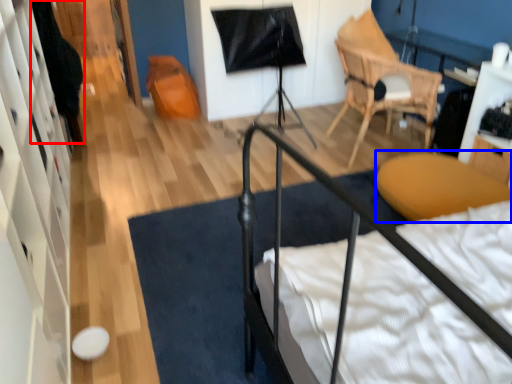
Question: Among these objects, which one is nearest to the camera, dark (highlighted by a red box) or furniture (highlighted by a blue box)?

Choices:
 (A) dark
 (B) furniture

Answer: (B)